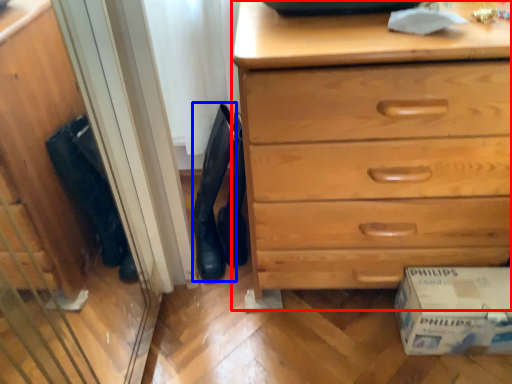
Question: Which object is further to the camera taking this photo, chest of drawers (highlighted by a red box) or boot (highlighted by a blue box)?

Choices:
 (A) chest of drawers
 (B) boot

Answer: (B)